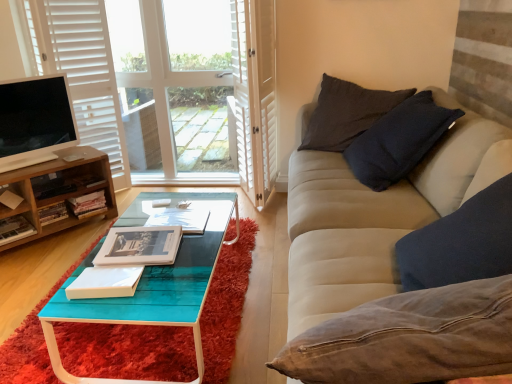
Question: In terms of width, does white paper book at center, which appears as the 1th book when viewed from the front, look wider or thinner when compared to hardcover book at lower left, the fourth book positioned from the back?

Choices:
 (A) thin
 (B) wide

Answer: (A)

Question: Do you think white paper book at center, marked as the seventh book in a back-to-front arrangement, is within hardcover book at lower left, the fourth book positioned from the back, or outside of it?

Choices:
 (A) inside
 (B) outside

Answer: (B)

Question: Which object is the farthest from the teal glossy wood coffee table at center?

Choices:
 (A) white glossy television at left
 (B) white matte curtain at left
 (C) wooden bookshelf at left, the 5th book when ordered from front to back
 (D) matte paper book at center, the 6th book positioned from the back
 (E) beige fabric couch at right

Answer: (B)

Question: Which is farther from the beige fabric couch at right?

Choices:
 (A) hardcover book at center, the 7th book from the front
 (B) white wood screen door at upper center
 (C) matte paper book at center, which appears as the 2th book when viewed from the front
 (D) wooden bookshelf at left, the 5th book when ordered from front to back
 (E) teal glossy wood coffee table at center

Answer: (D)